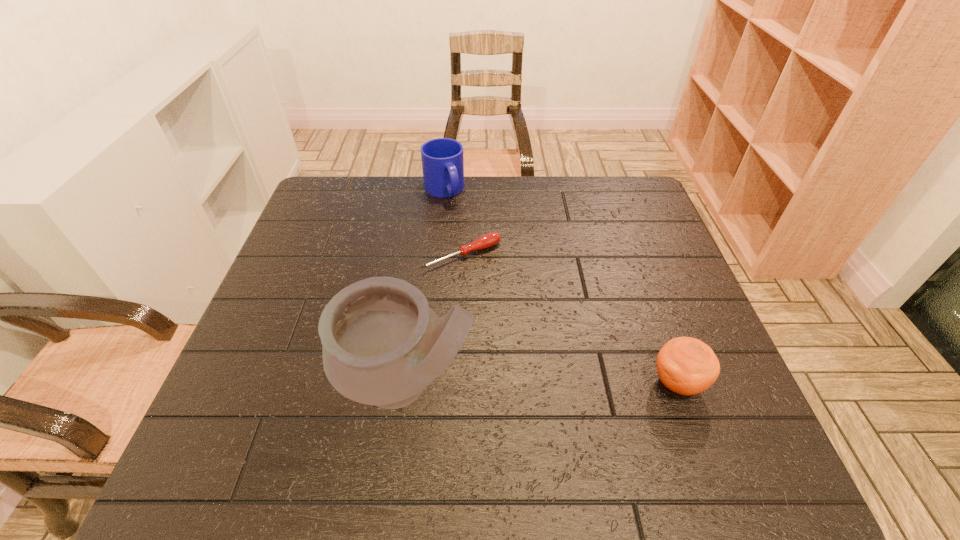
Locate an element on the screen. The height and width of the screenshot is (540, 960). pottery is located at coordinates click(x=382, y=344).

You are a GUI agent. You are given a task and a screenshot of the screen. Output one action in this format:
    pyautogui.click(x=<x>, y=<y>)
    Task: Click on the rightmost object
    This screenshot has height=540, width=960.
    Given the screenshot: What is the action you would take?
    pyautogui.click(x=685, y=365)

At what (x,y) coordinates should I click in order to perform the action: click on screwdriver. Please return your answer as a coordinate pair (x, y). This screenshot has height=540, width=960. Looking at the image, I should click on (488, 240).

This screenshot has width=960, height=540. Identify the location of the third nearest object. (488, 240).

Where is `the farthest object`? Image resolution: width=960 pixels, height=540 pixels. the farthest object is located at coordinates (442, 159).

At what (x,y) coordinates should I click in order to perform the action: click on free region located on the back of the tallest object. Please return your answer as a coordinate pair (x, y). Looking at the image, I should click on (420, 293).

Locate an element on the screen. free space located on the left of the orange is located at coordinates (457, 382).

Locate an element on the screen. vacant space situated at the tip of the third nearest object is located at coordinates (533, 327).

Image resolution: width=960 pixels, height=540 pixels. In order to click on vacant region located 0.280m at the tip of the third nearest object in this screenshot , I will do `click(549, 345)`.

I want to click on free space located 0.290m at the tip of the third nearest object, so click(x=552, y=348).